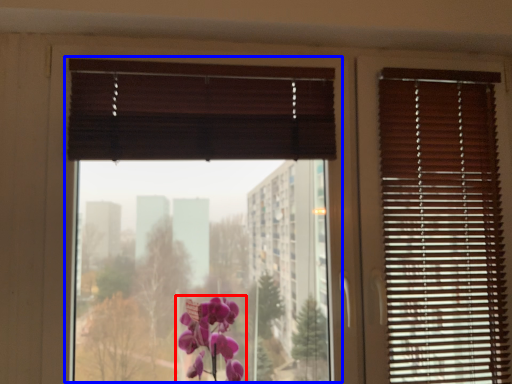
Question: Which object is further to the camera taking this photo, flower (highlighted by a red box) or window screen (highlighted by a blue box)?

Choices:
 (A) flower
 (B) window screen

Answer: (B)